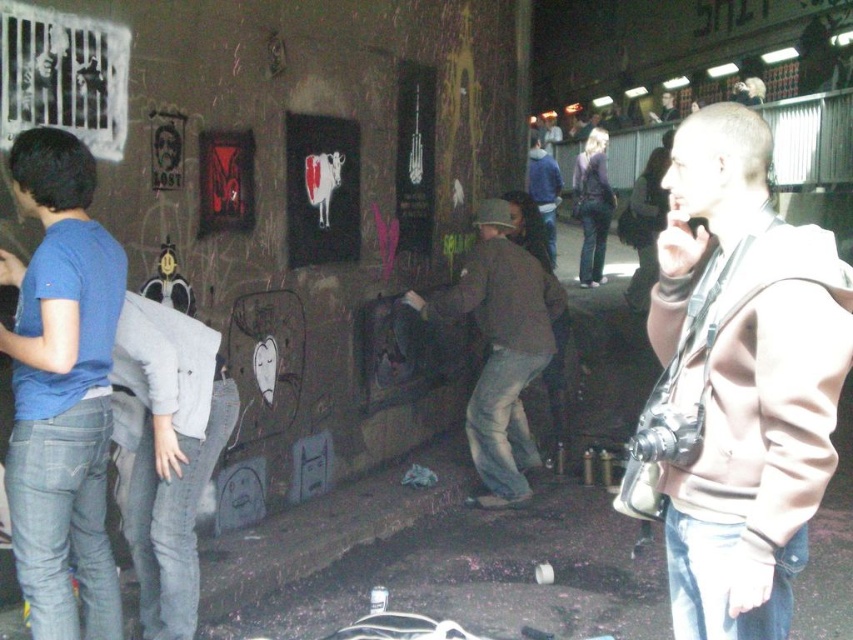
Based on the photo, which is above, brown cotton jacket at center or blue fleece jacket at center?

blue fleece jacket at center is higher up.

Based on the photo, can you confirm if brown cotton jacket at center is smaller than blue fleece jacket at center?

No, brown cotton jacket at center is not smaller than blue fleece jacket at center.

At what (x,y) coordinates should I click in order to perform the action: click on brown cotton jacket at center. Please return your answer as a coordinate pair (x, y). The width and height of the screenshot is (853, 640). Looking at the image, I should click on (502, 348).

Identify the location of brown cotton jacket at center. The width and height of the screenshot is (853, 640). (502, 348).

Is light brown leather jacket at center thinner than blue fleece jacket at center?

No, light brown leather jacket at center is not thinner than blue fleece jacket at center.

From the picture: Can you confirm if light brown leather jacket at center is positioned to the right of blue fleece jacket at center?

Indeed, light brown leather jacket at center is positioned on the right side of blue fleece jacket at center.

At what (x,y) coordinates should I click in order to perform the action: click on light brown leather jacket at center. Please return your answer as a coordinate pair (x, y). The width and height of the screenshot is (853, 640). Looking at the image, I should click on (646, 225).

You are a GUI agent. You are given a task and a screenshot of the screen. Output one action in this format:
    pyautogui.click(x=<x>, y=<y>)
    Task: Click on the light brown leather jacket at center
    
    Given the screenshot: What is the action you would take?
    pyautogui.click(x=646, y=225)

Consider the image. Which is below, brown cotton jacket at center or denim jacket at upper center?

brown cotton jacket at center

Who is positioned more to the right, brown cotton jacket at center or denim jacket at upper center?

From the viewer's perspective, denim jacket at upper center appears more on the right side.

Where is `brown cotton jacket at center`? The width and height of the screenshot is (853, 640). brown cotton jacket at center is located at coordinates (502, 348).